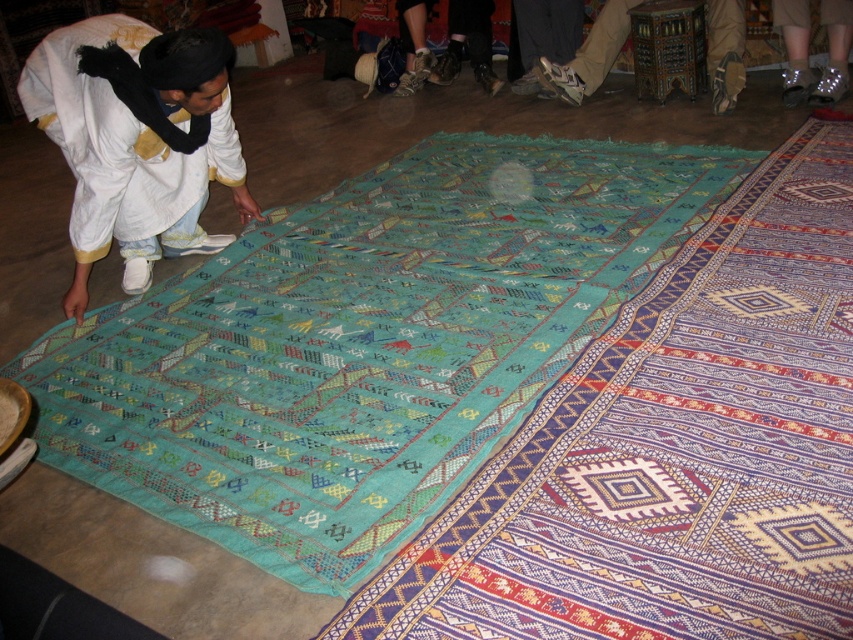
You are a photographer trying to capture the entire multicolored woven rug at center and the white cotton clothing at center in a single frame. Given that the camera can only focus on objects within a 1.5 meter width, will both items fit in the frame if positioned side by side?

The multicolored woven rug at center has a larger size compared to white cotton clothing at center. Since the rug is bigger, when placed side by side, the total width might exceed the camera frame limit of 1.5 meters. However, without exact measurements, it is uncertain. The photographer should adjust the camera angle or move the items closer together to ensure both fit within the frame.

You are standing in the room and want to place a small decoration between the two points labeled point (x=68, y=227) and point (x=488, y=29). Which point should you start from to ensure the decoration is closer to the viewer?

You should start from point (x=68, y=227) because it is closer to the viewer than point (x=488, y=29).